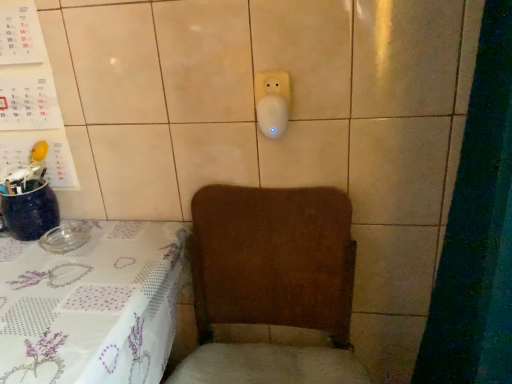
Describe the element at coordinates (271, 284) in the screenshot. I see `brown fabric armchair at lower center` at that location.

The width and height of the screenshot is (512, 384). Describe the element at coordinates (29, 94) in the screenshot. I see `white paper calendar at upper left` at that location.

Measure the distance between white plastic socket at upper center and camera.

The depth of white plastic socket at upper center is 34.27 inches.

This screenshot has height=384, width=512. Describe the element at coordinates (272, 102) in the screenshot. I see `white plastic socket at upper center` at that location.

The image size is (512, 384). In order to click on brown fabric armchair at lower center in this screenshot , I will do `click(271, 284)`.

From a real-world perspective, which object rests below the other?

In real-world perspective, brown fabric armchair at lower center is lower.

Which is more to the left, brown fabric armchair at lower center or white paper calendar at upper left?

white paper calendar at upper left.

From the image's perspective, is brown fabric armchair at lower center located above white paper calendar at upper left?

No, from the image's perspective, brown fabric armchair at lower center is not above white paper calendar at upper left.

Which object is wider, brown fabric armchair at lower center or white paper calendar at upper left?

Wider between the two is brown fabric armchair at lower center.

From their relative heights in the image, would you say white printed fabric tablecloth at lower left is taller or shorter than white plastic socket at upper center?

Clearly, white printed fabric tablecloth at lower left is taller compared to white plastic socket at upper center.

Where is `furniture below the white plastic socket at upper center (from the image's perspective)`? This screenshot has width=512, height=384. furniture below the white plastic socket at upper center (from the image's perspective) is located at coordinates (92, 305).

In the scene shown: Considering the sizes of objects white printed fabric tablecloth at lower left and white plastic socket at upper center in the image provided, who is bigger, white printed fabric tablecloth at lower left or white plastic socket at upper center?

white printed fabric tablecloth at lower left is bigger.

Which of these two, white printed fabric tablecloth at lower left or white plastic socket at upper center, is wider?

Wider between the two is white printed fabric tablecloth at lower left.

Between white paper calendar at upper left and white plastic socket at upper center, which one has more height?

white paper calendar at upper left is taller.

Considering the points (2, 80) and (284, 110), which point is behind, point (2, 80) or point (284, 110)?

Positioned behind is point (2, 80).

Is white paper calendar at upper left positioned beyond the bounds of white plastic socket at upper center?

Yes, white paper calendar at upper left is not within white plastic socket at upper center.

Is white plastic socket at upper center looking in the opposite direction of brown fabric armchair at lower center?

No, white plastic socket at upper center is not facing away from brown fabric armchair at lower center.

Between point (256, 91) and point (303, 237), which one is positioned behind?

Point (303, 237)

Considering the positions of objects white plastic socket at upper center and brown fabric armchair at lower center in the image provided, who is in front, white plastic socket at upper center or brown fabric armchair at lower center?

brown fabric armchair at lower center is closer to the camera.

Is white plastic socket at upper center not inside brown fabric armchair at lower center?

Yes.

This screenshot has width=512, height=384. Find the location of `furniture that appears on the left of brown fabric armchair at lower center`. furniture that appears on the left of brown fabric armchair at lower center is located at coordinates (92, 305).

Is white printed fabric tablecloth at lower left smaller than brown fabric armchair at lower center?

No, white printed fabric tablecloth at lower left is not smaller than brown fabric armchair at lower center.

From a real-world perspective, is white printed fabric tablecloth at lower left positioned over brown fabric armchair at lower center based on gravity?

No, from a real-world perspective, white printed fabric tablecloth at lower left is not on top of brown fabric armchair at lower center.

Which of these two, white printed fabric tablecloth at lower left or brown fabric armchair at lower center, stands shorter?

Standing shorter between the two is white printed fabric tablecloth at lower left.

From a real-world perspective, which is physically below, white printed fabric tablecloth at lower left or white paper calendar at upper left?

From a 3D spatial view, white printed fabric tablecloth at lower left is below.

Can you confirm if white printed fabric tablecloth at lower left is smaller than white paper calendar at upper left?

Actually, white printed fabric tablecloth at lower left might be larger than white paper calendar at upper left.

Is white printed fabric tablecloth at lower left turned away from white paper calendar at upper left?

white printed fabric tablecloth at lower left does not have its back to white paper calendar at upper left.

Are white printed fabric tablecloth at lower left and white paper calendar at upper left located far from each other?

No, there isn't a large distance between white printed fabric tablecloth at lower left and white paper calendar at upper left.

Can we say brown fabric armchair at lower center lies outside white printed fabric tablecloth at lower left?

brown fabric armchair at lower center is positioned outside white printed fabric tablecloth at lower left.

Could you tell me if brown fabric armchair at lower center is turned towards white printed fabric tablecloth at lower left?

No, brown fabric armchair at lower center is not oriented towards white printed fabric tablecloth at lower left.

From the image's perspective, which object appears higher, brown fabric armchair at lower center or white printed fabric tablecloth at lower left?

brown fabric armchair at lower center, from the image's perspective.

Does brown fabric armchair at lower center have a smaller size compared to white printed fabric tablecloth at lower left?

Yes, brown fabric armchair at lower center is smaller than white printed fabric tablecloth at lower left.

Find the location of a particular element. armchair that appears in front of the white paper calendar at upper left is located at coordinates (271, 284).

Identify the location of furniture on the left of white plastic socket at upper center. (92, 305).

Based on their spatial positions, is white printed fabric tablecloth at lower left or brown fabric armchair at lower center further from white paper calendar at upper left?

The object further to white paper calendar at upper left is brown fabric armchair at lower center.

Considering their positions, is white printed fabric tablecloth at lower left positioned further to white plastic socket at upper center than white paper calendar at upper left?

white paper calendar at upper left lies further to white plastic socket at upper center than the other object.

Which object lies nearer to the anchor point white printed fabric tablecloth at lower left, white paper calendar at upper left or white plastic socket at upper center?

white paper calendar at upper left is closer to white printed fabric tablecloth at lower left.

Estimate the real-world distances between objects in this image. Which object is closer to white printed fabric tablecloth at lower left, brown fabric armchair at lower center or white plastic socket at upper center?

brown fabric armchair at lower center is positioned closer to the anchor white printed fabric tablecloth at lower left.

From the image, which object appears to be farther from brown fabric armchair at lower center, white plastic socket at upper center or white paper calendar at upper left?

white paper calendar at upper left is further to brown fabric armchair at lower center.

From the picture: Considering their positions, is white paper calendar at upper left positioned further to brown fabric armchair at lower center than white plastic socket at upper center?

white paper calendar at upper left is further to brown fabric armchair at lower center.

From the image, which object appears to be nearer to white plastic socket at upper center, brown fabric armchair at lower center or white paper calendar at upper left?

brown fabric armchair at lower center is positioned closer to the anchor white plastic socket at upper center.

From the image, which object appears to be farther from white paper calendar at upper left, white printed fabric tablecloth at lower left or white plastic socket at upper center?

Among the two, white plastic socket at upper center is located further to white paper calendar at upper left.

Locate an element on the screen. This screenshot has height=384, width=512. armchair that lies between white plastic socket at upper center and white printed fabric tablecloth at lower left from top to bottom is located at coordinates (271, 284).

The height and width of the screenshot is (384, 512). Identify the location of bulletin board between white plastic socket at upper center and white printed fabric tablecloth at lower left in the vertical direction. (29, 94).

The height and width of the screenshot is (384, 512). In order to click on armchair between white paper calendar at upper left and white printed fabric tablecloth at lower left in the vertical direction in this screenshot , I will do `click(271, 284)`.

Locate an element on the screen. The width and height of the screenshot is (512, 384). armchair between white paper calendar at upper left and white plastic socket at upper center in the horizontal direction is located at coordinates (271, 284).